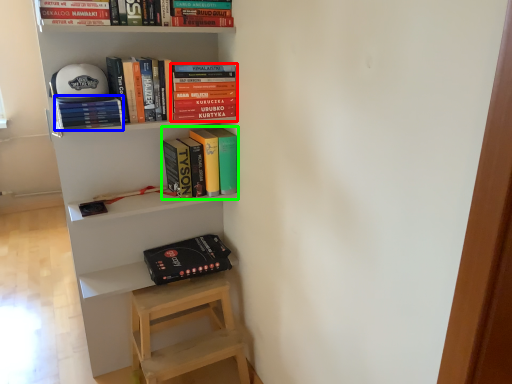
Question: Which object is positioned farthest from book (highlighted by a red box)? Select from book (highlighted by a blue box) and book (highlighted by a green box).

Choices:
 (A) book
 (B) book

Answer: (A)